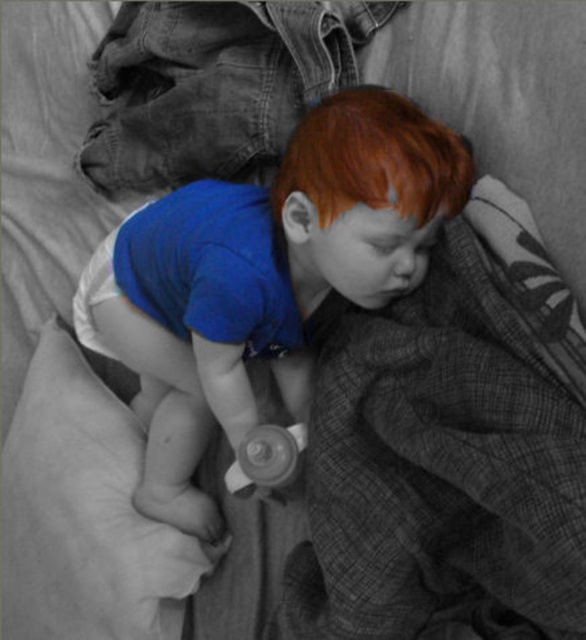
Is blue cotton shirt at center positioned behind rubberized white pacifier at center?

That is False.

Who is more distant from viewer, [195,397] or [281,428]?

The point [195,397] is more distant.

In the scene shown: Who is more distant from viewer, (114, 294) or (243, 484)?

The point (114, 294) is behind.

Locate an element on the screen. Image resolution: width=586 pixels, height=640 pixels. blue cotton shirt at center is located at coordinates (263, 276).